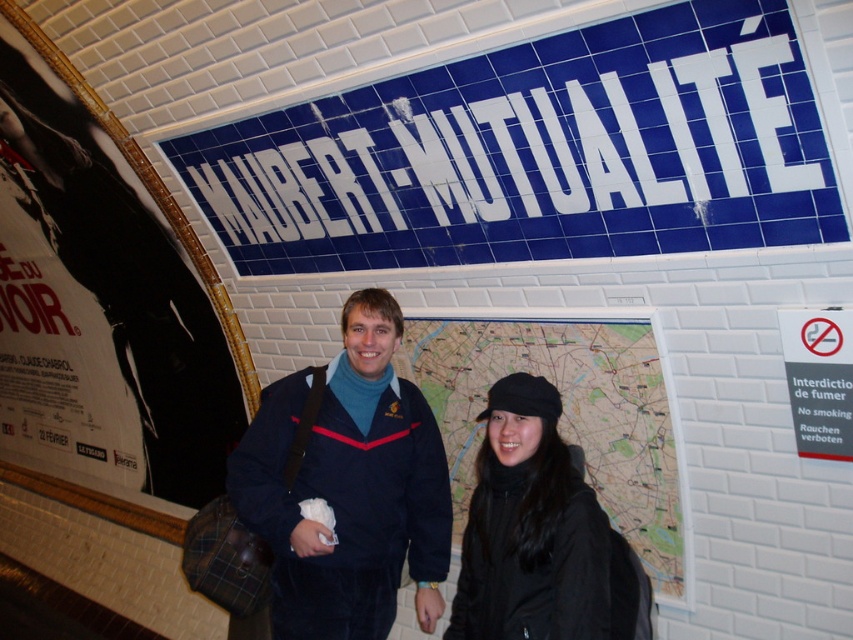
Can you confirm if blue tile sign at upper center is bigger than white paper poster at left?

Actually, blue tile sign at upper center might be smaller than white paper poster at left.

Can you confirm if blue tile sign at upper center is positioned below white paper poster at left?

Actually, blue tile sign at upper center is above white paper poster at left.

Which is behind, point (721, 230) or point (16, 376)?

The point (16, 376) is more distant.

This screenshot has height=640, width=853. I want to click on blue tile sign at upper center, so click(537, 154).

Does white paper poster at left have a lesser width compared to black matte hat at center?

No, white paper poster at left is not thinner than black matte hat at center.

Who is more forward, (4,196) or (572,554)?

Point (572,554)

The image size is (853, 640). I want to click on white paper poster at left, so click(103, 296).

Measure the distance between point (x=6, y=400) and camera.

A distance of 17.88 feet exists between point (x=6, y=400) and camera.

Is white paper poster at left closer to camera compared to velvet blue jacket at center?

No, it is not.

At what (x,y) coordinates should I click in order to perform the action: click on white paper poster at left. Please return your answer as a coordinate pair (x, y). The width and height of the screenshot is (853, 640). Looking at the image, I should click on (103, 296).